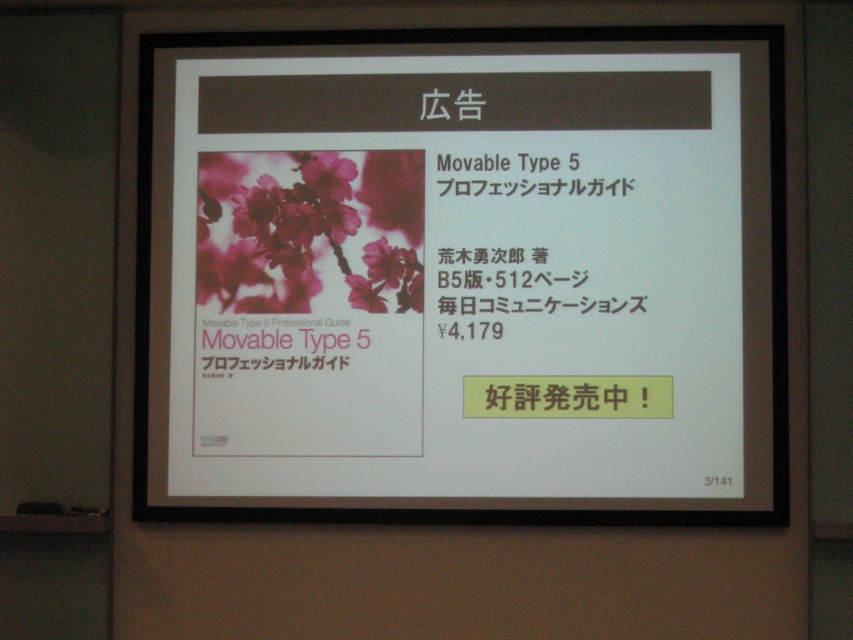
What is the relationship between the size of the matte paper cover at center and the pink matte text at center?

The matte paper cover at center is much taller than the pink matte text at center.